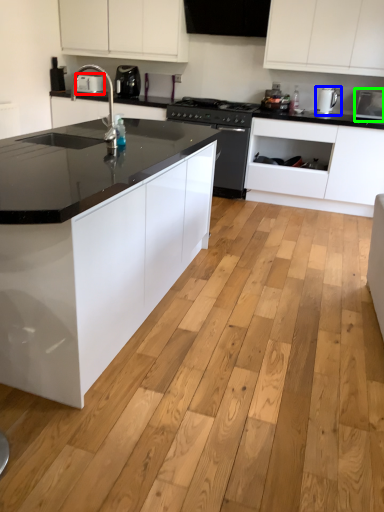
Question: Which is farther away from appliance (highlighted by a red box)? kitchen appliance (highlighted by a blue box) or appliance (highlighted by a green box)?

Choices:
 (A) kitchen appliance
 (B) appliance

Answer: (B)